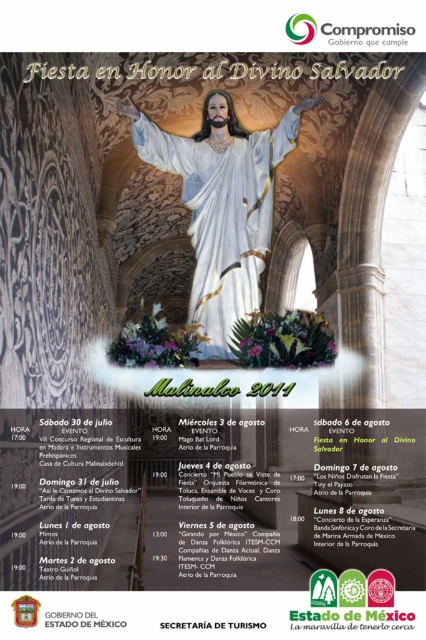
Based on the scene described, where is the white marble statue at center located in relation to the point marked at coordinates [222,204]?

The white marble statue at center is located exactly at the point marked at coordinates [222,204].

Based on the poster for the Fiesta en Honor al Divino Salvador, where is the white marble statue at center located in terms of coordinates?

The white marble statue at center is located at coordinates point (222, 204).